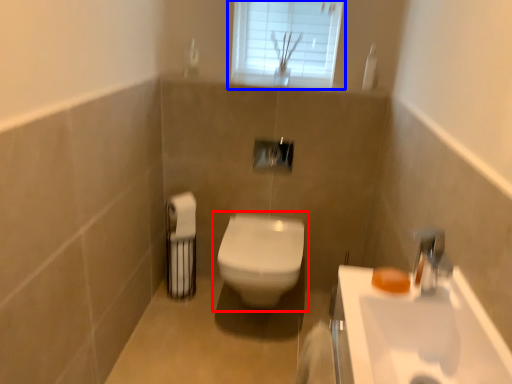
Question: Which object appears farthest to the camera in this image, toilet (highlighted by a red box) or window (highlighted by a blue box)?

Choices:
 (A) toilet
 (B) window

Answer: (B)